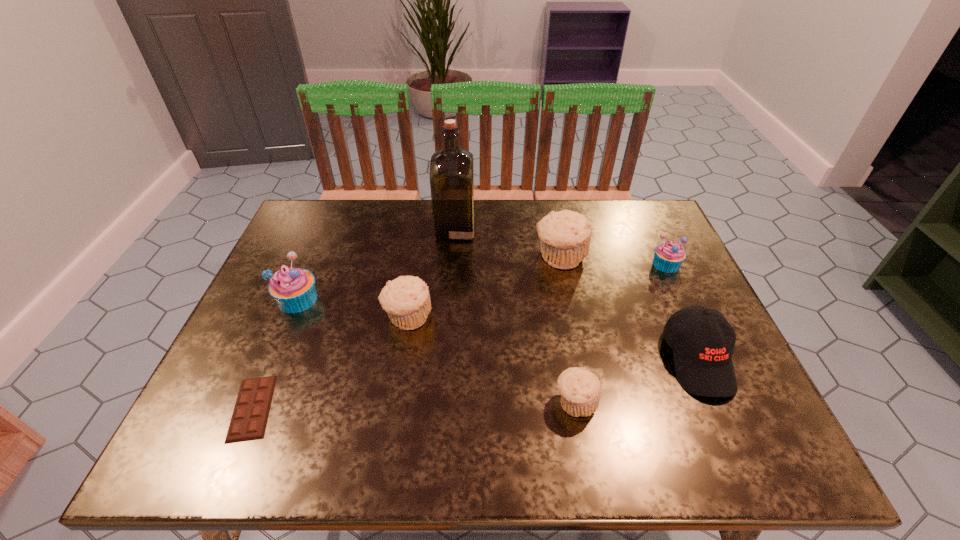
At what (x,y) coordinates should I click in order to perform the action: click on liquor. Please return your answer as a coordinate pair (x, y). This screenshot has width=960, height=540. Looking at the image, I should click on (451, 169).

At what (x,y) coordinates should I click in order to perform the action: click on the tallest muffin. Please return your answer as a coordinate pair (x, y). This screenshot has width=960, height=540. Looking at the image, I should click on (565, 236).

This screenshot has width=960, height=540. Identify the location of the seventh shortest object. (565, 236).

The image size is (960, 540). I want to click on the left blue muffin, so click(x=293, y=288).

Find the location of a particular element. the nearer blue muffin is located at coordinates (293, 288).

The height and width of the screenshot is (540, 960). I want to click on the second farthest beige muffin, so click(x=406, y=299).

I want to click on the leftmost beige muffin, so click(x=406, y=299).

Find the location of `black baseball cap`. black baseball cap is located at coordinates (703, 341).

The width and height of the screenshot is (960, 540). Identify the location of the farther blue muffin. (668, 256).

Where is `the right blue muffin`? This screenshot has height=540, width=960. the right blue muffin is located at coordinates (668, 256).